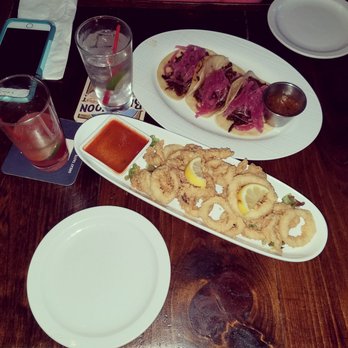
Image resolution: width=348 pixels, height=348 pixels. Find the location of `glass of water`. glass of water is located at coordinates (103, 71).